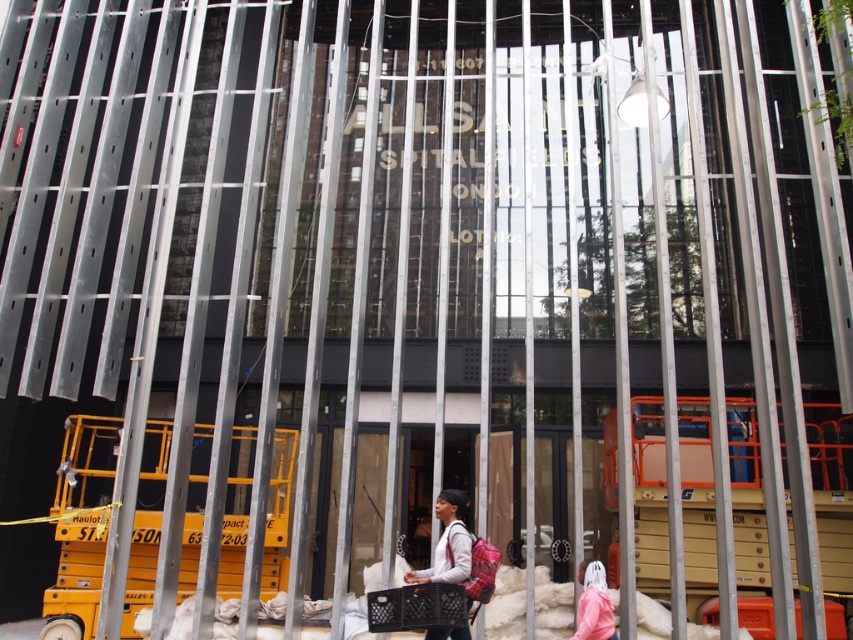
Locate an element on the screen. plaid fabric backpack at center is located at coordinates (448, 541).

How far apart are plaid fabric backpack at center and pink fabric at lower right?

11.22 feet

This screenshot has height=640, width=853. Identify the location of plaid fabric backpack at center. (448, 541).